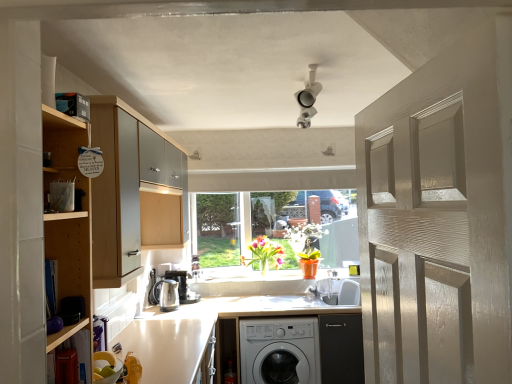
Question: Could white glossy countertop at lower center be considered to be inside satin silver kettle at lower left, placed as the second appliance when sorted from back to front?

Choices:
 (A) yes
 (B) no

Answer: (B)

Question: Does satin silver kettle at lower left, placed as the second appliance when sorted from back to front, turn towards white glossy countertop at lower center?

Choices:
 (A) yes
 (B) no

Answer: (B)

Question: Does satin silver kettle at lower left, placed as the second appliance when sorted from back to front, lie in front of white glossy countertop at lower center?

Choices:
 (A) yes
 (B) no

Answer: (B)

Question: Is satin silver kettle at lower left, placed as the second appliance when sorted from back to front, shorter than white glossy countertop at lower center?

Choices:
 (A) yes
 (B) no

Answer: (A)

Question: Can you confirm if satin silver kettle at lower left, placed as the second appliance when sorted from back to front, is wider than white glossy countertop at lower center?

Choices:
 (A) yes
 (B) no

Answer: (B)

Question: Is orange matte pot at center, the first plant in the right-to-left sequence, taller or shorter than wooden shelf at left, which appears as the 1th cabinetry when viewed from the front?

Choices:
 (A) tall
 (B) short

Answer: (B)

Question: From the image's perspective, is orange matte pot at center, which is counted as the second plant, starting from the left, above or below wooden shelf at left, which appears as the 1th cabinetry when viewed from the front?

Choices:
 (A) below
 (B) above

Answer: (A)

Question: Is orange matte pot at center, which is counted as the second plant, starting from the left, spatially inside wooden shelf at left, which appears as the 1th cabinetry when viewed from the front, or outside of it?

Choices:
 (A) inside
 (B) outside

Answer: (B)

Question: Is point (316, 236) closer or farther from the camera than point (48, 352)?

Choices:
 (A) farther
 (B) closer

Answer: (A)

Question: Is satin silver kettle at lower left, placed as the second appliance when sorted from back to front, to the left or to the right of translucent glass vase at center, arranged as the second plant when viewed from the right, in the image?

Choices:
 (A) left
 (B) right

Answer: (A)

Question: In the image, is satin silver kettle at lower left, positioned as the first appliance in front-to-back order, positioned in front of or behind translucent glass vase at center, arranged as the 1th plant when viewed from the left?

Choices:
 (A) behind
 (B) front

Answer: (B)

Question: Looking at their shapes, would you say satin silver kettle at lower left, positioned as the first appliance in front-to-back order, is wider or thinner than translucent glass vase at center, arranged as the 1th plant when viewed from the left?

Choices:
 (A) thin
 (B) wide

Answer: (B)

Question: From their relative heights in the image, would you say satin silver kettle at lower left, placed as the second appliance when sorted from back to front, is taller or shorter than translucent glass vase at center, arranged as the second plant when viewed from the right?

Choices:
 (A) short
 (B) tall

Answer: (A)

Question: Visually, is wooden cabinet at left, the 1th cabinetry when ordered from back to front, positioned to the left or to the right of satin silver kettle at lower left, placed as the second appliance when sorted from back to front?

Choices:
 (A) right
 (B) left

Answer: (B)

Question: Do you think wooden cabinet at left, placed as the 2th cabinetry when sorted from front to back, is within satin silver kettle at lower left, positioned as the first appliance in front-to-back order, or outside of it?

Choices:
 (A) inside
 (B) outside

Answer: (B)